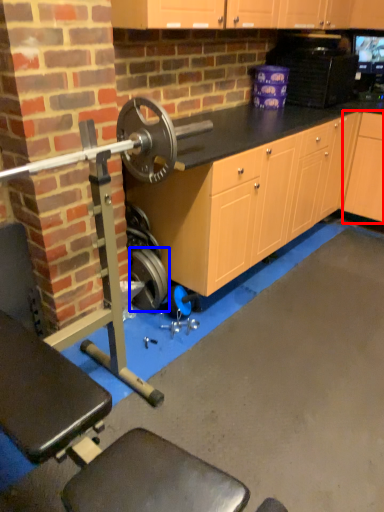
Question: Which point is further to the camera, cabinetry (highlighted by a red box) or wheel (highlighted by a blue box)?

Choices:
 (A) cabinetry
 (B) wheel

Answer: (A)